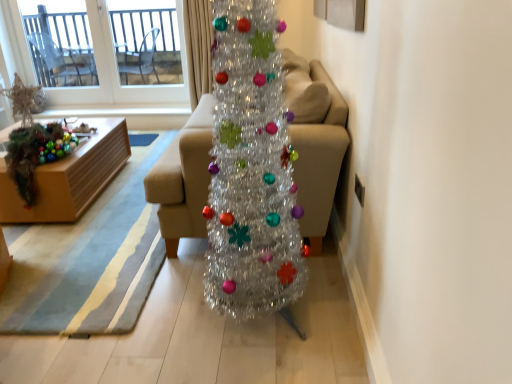
I want to click on vacant area that is in front of shiny metallic christmas tree at center, so click(258, 358).